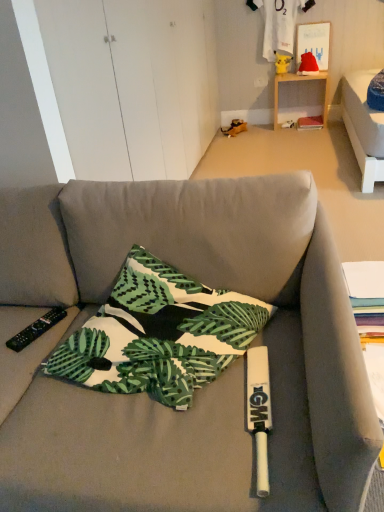
Question: From the image's perspective, is wooden shelf at upper right above or below black plastic remote control at lower left?

Choices:
 (A) below
 (B) above

Answer: (B)

Question: Considering the positions of wooden shelf at upper right and black plastic remote control at lower left in the image, is wooden shelf at upper right taller or shorter than black plastic remote control at lower left?

Choices:
 (A) short
 (B) tall

Answer: (B)

Question: Considering the real-world distances, which object is closest to the white cotton t-shirt at upper center?

Choices:
 (A) wooden shelf at upper right
 (B) black plastic remote control at lower left
 (C) printed fabric pillow at center

Answer: (A)

Question: Considering the real-world distances, which object is closest to the printed fabric pillow at center?

Choices:
 (A) black plastic remote control at lower left
 (B) wooden shelf at upper right
 (C) white cotton t-shirt at upper center

Answer: (A)